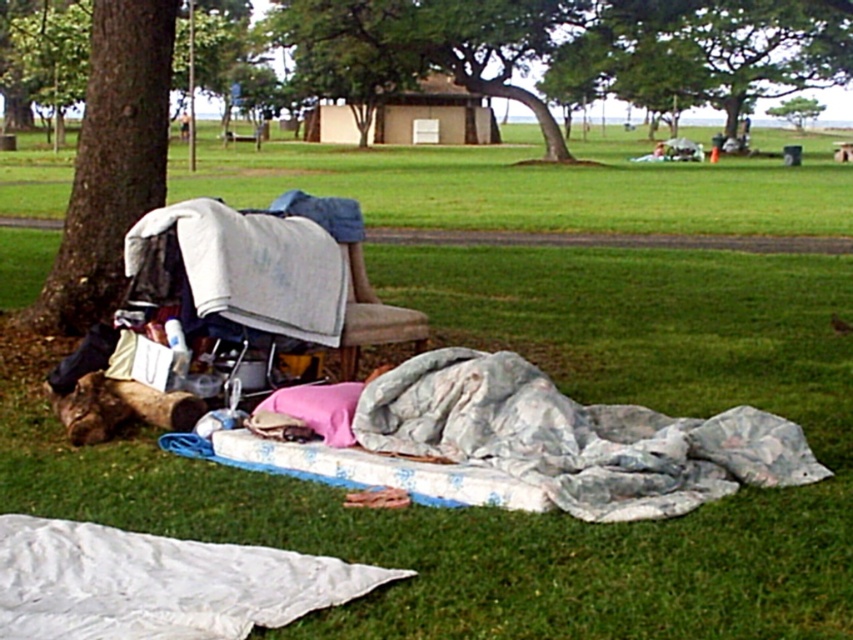
You are a photographer setting up equipment in the park. You need to place a tripod between the brown rough bark tree at left and the white fabric at left. Since the tripod requires a flat surface, which object should you position the tripod closer to to ensure stability?

You should position the tripod closer to the white fabric at left because the brown rough bark tree at left is further away from you, making the white fabric at left the closer and more accessible flat surface for the tripod.

Consider the image. What is located at the coordinates point (445, 40) in the image?

The green leafy tree at center is located at point (445, 40).